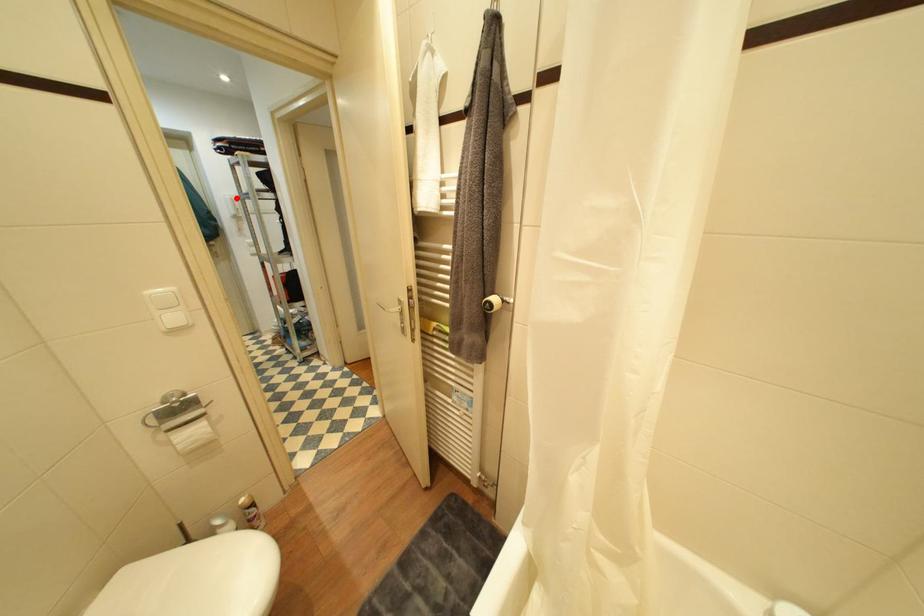
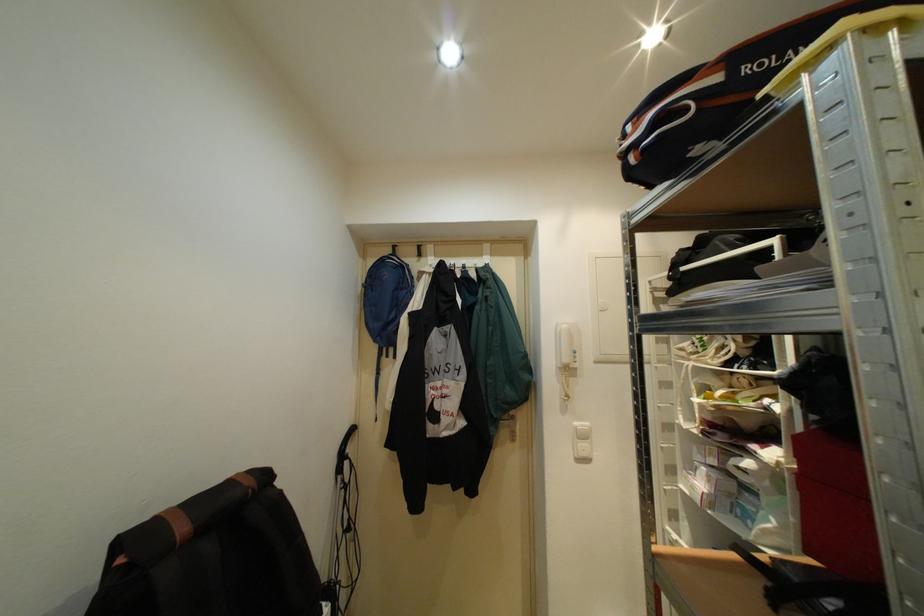
Question: I am providing you with two images of the same scene from different viewpoints. A red point is marked on the first image. Can you still see the location of the red point in image 2?

Choices:
 (A) Yes
 (B) No

Answer: (A)